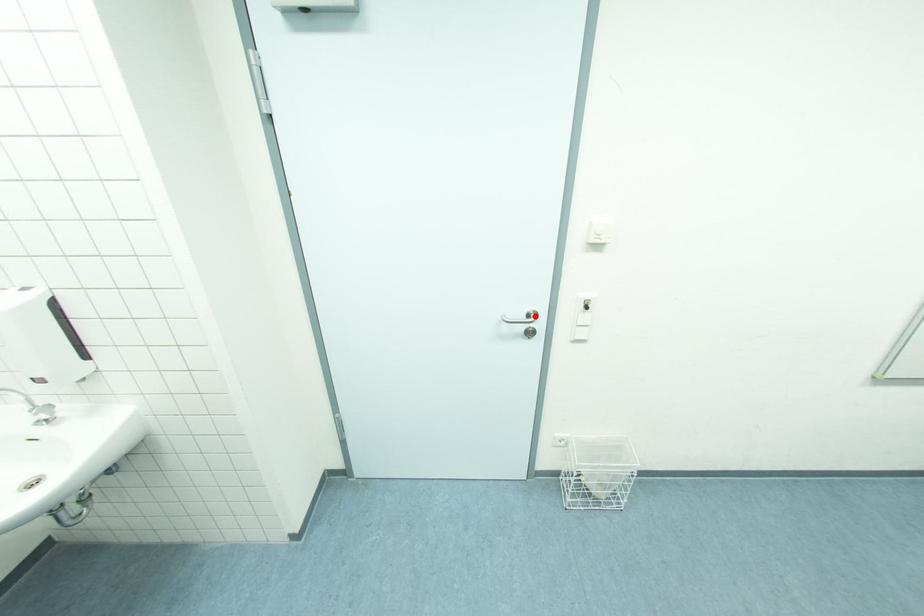
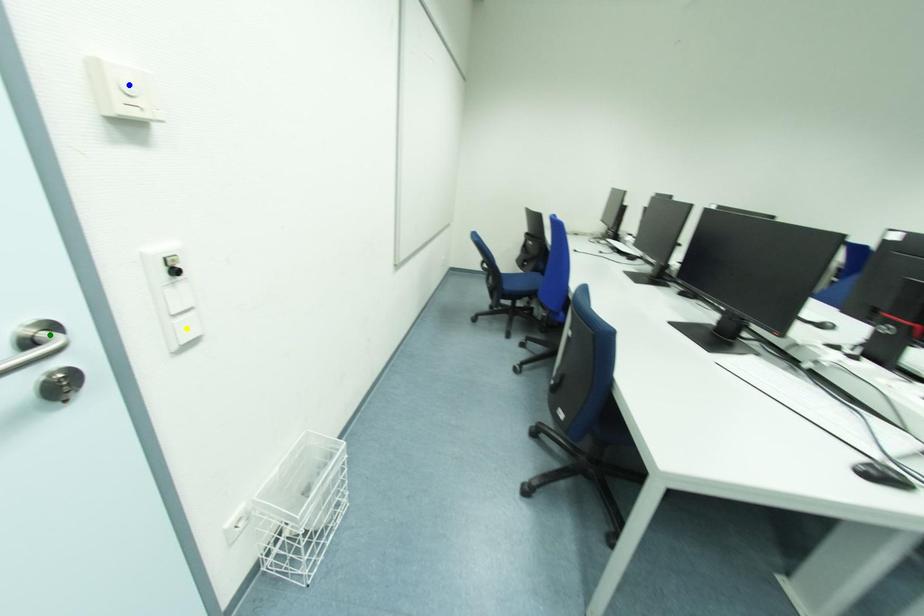
Question: I am providing you with two images of the same scene from different viewpoints. A red point is marked on the first image. You are given multiple points on the second image. Which mark in image 2 goes with the point in image 1?

Choices:
 (A) yellow point
 (B) blue point
 (C) green point

Answer: (C)